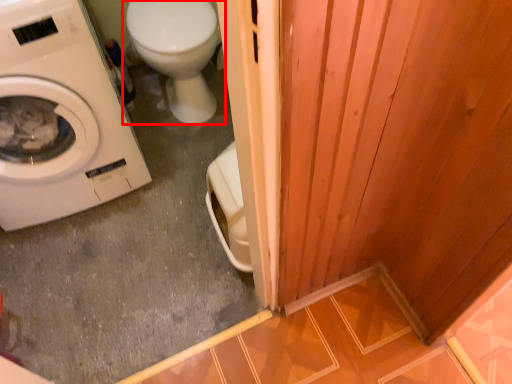
Question: From the image's perspective, considering the relative positions of toilet (annotated by the red box) and washing machine in the image provided, where is toilet (annotated by the red box) located with respect to the staircase?

Choices:
 (A) above
 (B) below

Answer: (A)